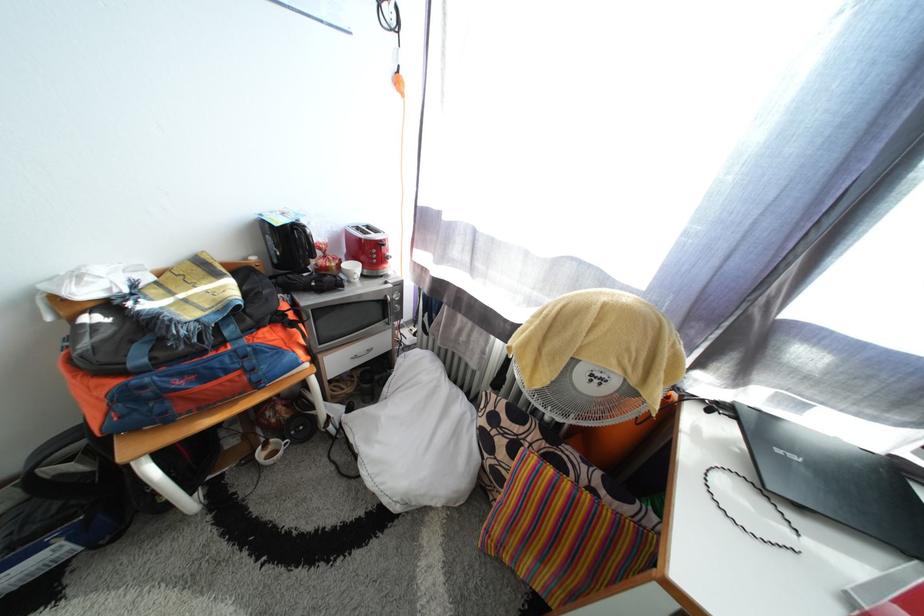
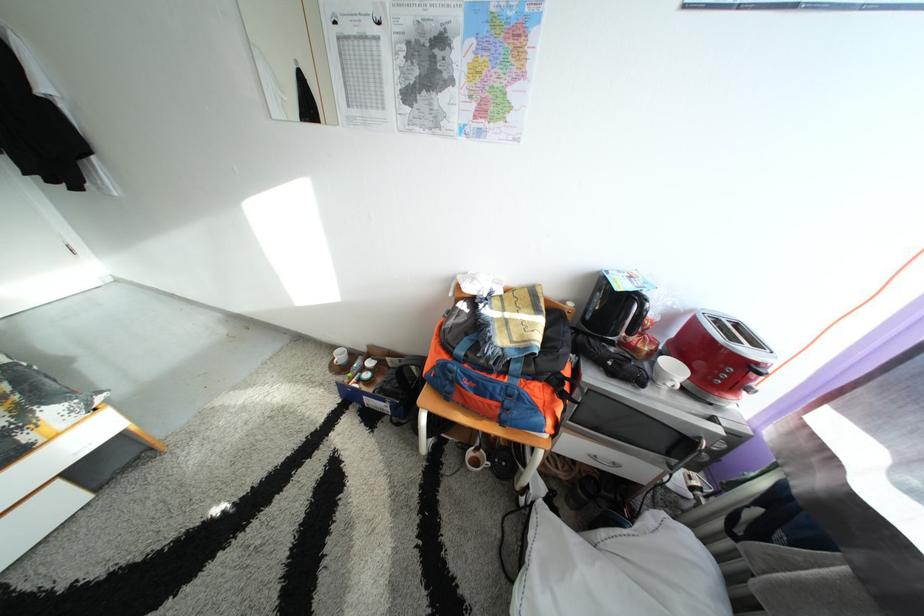
Question: The camera is either moving clockwise (left) or counter-clockwise (right) around the object. The first image is from the beginning of the video and the second image is from the end. Is the camera moving left or right when shooting the video?

Choices:
 (A) Left
 (B) Right

Answer: (B)